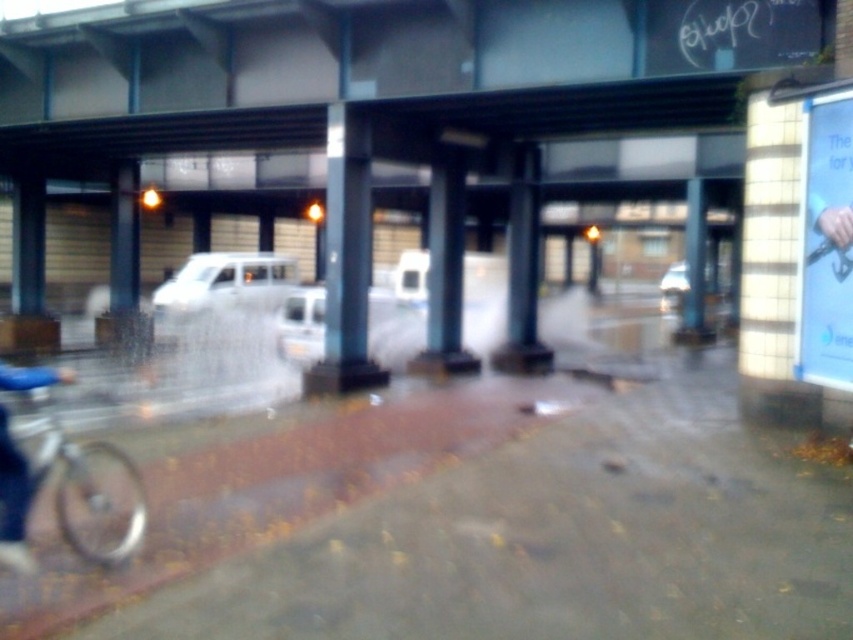
You are standing at the center of the walkway and want to reach the silver metallic bicycle at lower left. Which direction should you move to reach it?

Since the silver metallic bicycle at lower left is located at point [84,486], you should move to the left and downward from your current position at the center to reach it.

You are a delivery person who needs to load both the silver metallic bicycle at lower left and the white matte van at center into a storage container. The container has a height limit of 1.5 meters. Can both items be placed inside without exceeding the height restriction?

The silver metallic bicycle at lower left has a lesser height compared to white matte van at center. Since the van is taller than the bicycle, we need to check if the van meets the height limit. However, the description only states the bicycle is shorter than the van but does not provide exact measurements. Without knowing the actual height of the van, we cannot confirm if both items fit within the 1.5 meter limit.